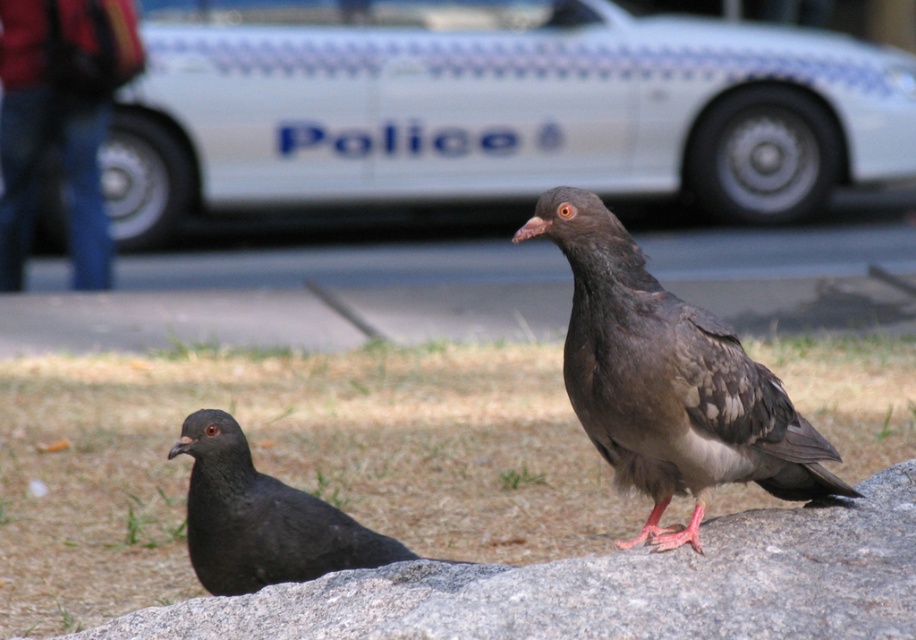
You are a photographer trying to capture both the gray granite rock at center and the matte black pigeon at lower left in a single frame. Based on their positions, which object would you need to adjust your camera angle to include first?

The matte black pigeon at lower left is positioned lower on the rock, so you would need to adjust your camera angle to include it first before capturing the gray granite rock at center.

You are a hiker who has just reached the summit and wants to place your red backpack at upper left on the rocky surface where the matte black pigeon at lower left is perched. Can you do this without disturbing the pigeon?

The red backpack at upper left is larger than the matte black pigeon at lower left. Placing the backpack might displace the pigeon since it occupies more space.